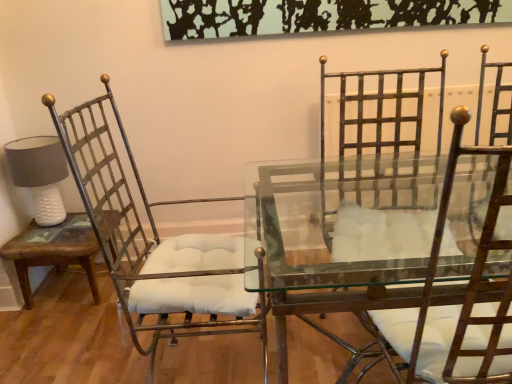
Question: Would you say white textured lampshade at left is inside or outside clear glass table at center?

Choices:
 (A) inside
 (B) outside

Answer: (B)

Question: In the image, is white textured lampshade at left positioned in front of or behind clear glass table at center?

Choices:
 (A) behind
 (B) front

Answer: (A)

Question: Based on their relative distances, which object is nearer to the clear glass table at center?

Choices:
 (A) white textured lampshade at left
 (B) metallic white cushioned chair at left, the 2th chair from the right
 (C) metallic iron chair at right, the second chair when ordered from left to right
 (D) brown wood side table at left

Answer: (B)

Question: Considering the real-world distances, which object is closest to the metallic white cushioned chair at left, the 2th chair from the right?

Choices:
 (A) white textured lampshade at left
 (B) brown wood side table at left
 (C) metallic iron chair at right, the second chair when ordered from left to right
 (D) clear glass table at center

Answer: (D)